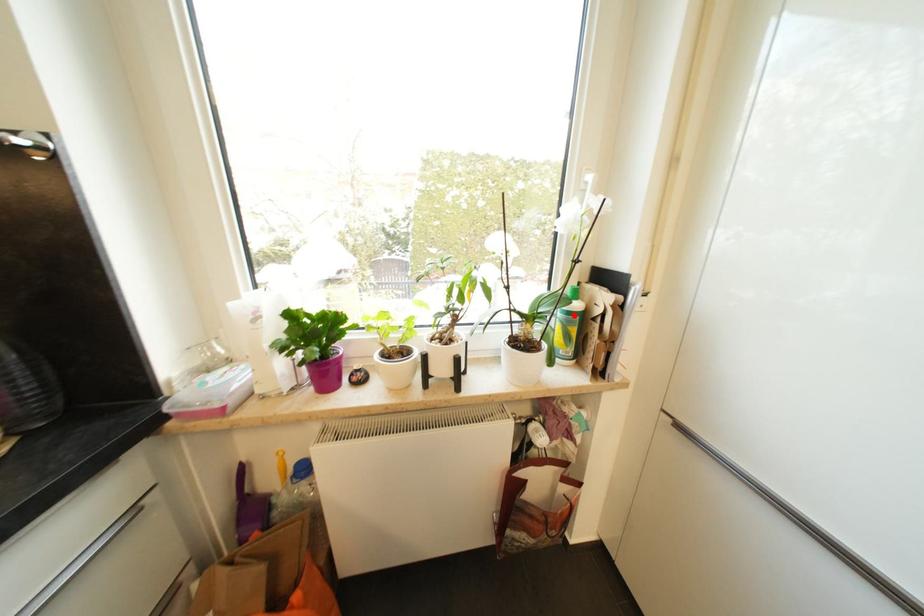
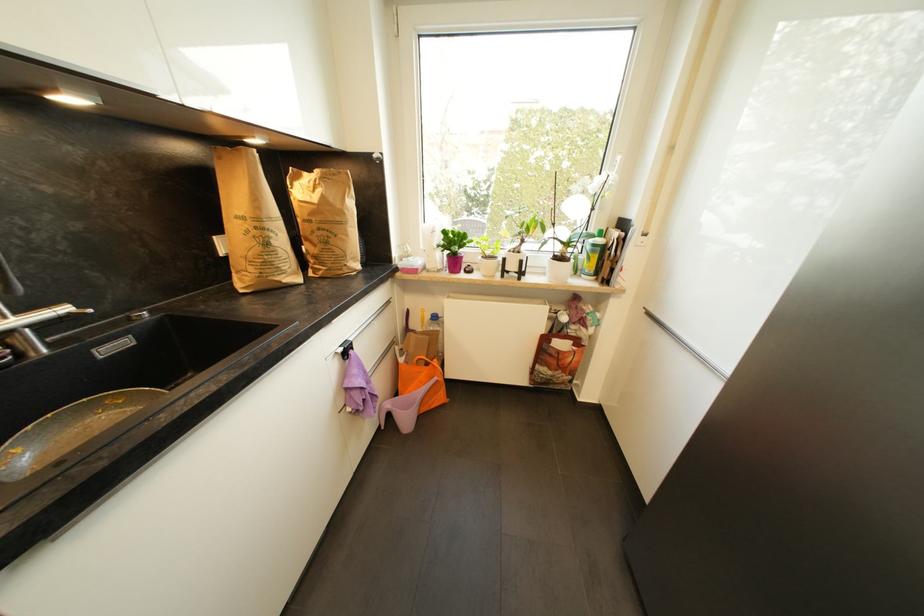
Locate, in the second image, the point that corresponds to the highlighted location in the first image.

(599, 246)